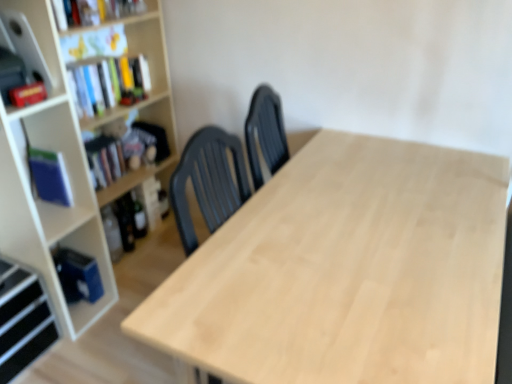
Locate an element on the screen. This screenshot has height=384, width=512. blue matte book at left, which is the third book in top-to-bottom order is located at coordinates (48, 174).

At what (x,y) coordinates should I click in order to perform the action: click on wooden bookshelf at upper left, which is the second shelf from left to right. Please return your answer as a coordinate pair (x, y). Image resolution: width=512 pixels, height=384 pixels. Looking at the image, I should click on (141, 44).

The image size is (512, 384). Describe the element at coordinates (94, 11) in the screenshot. I see `hardcover book at upper left, the first book from the top` at that location.

Describe the element at coordinates (42, 37) in the screenshot. I see `matte white cabinet at upper left` at that location.

I want to click on blue matte book at left, which is the third book in top-to-bottom order, so click(x=48, y=174).

Which point is more forward, (45, 20) or (165, 59)?

The point (45, 20) is more forward.

Is matte white cabinet at upper left positioned beyond the bounds of wooden bookshelf at upper left, the 2th shelf in the bottom-to-top sequence?

Indeed, matte white cabinet at upper left is completely outside wooden bookshelf at upper left, the 2th shelf in the bottom-to-top sequence.

From the picture: Considering the positions of objects matte white cabinet at upper left and wooden bookshelf at upper left, which is the second shelf from left to right, in the image provided, who is behind, matte white cabinet at upper left or wooden bookshelf at upper left, which is the second shelf from left to right,?

wooden bookshelf at upper left, which is the second shelf from left to right, is further from the camera.

Considering the relative positions of matte white cabinet at upper left and black plastic shelf at lower left, placed as the 2th shelf when sorted from top to bottom, in the image provided, is matte white cabinet at upper left to the right of black plastic shelf at lower left, placed as the 2th shelf when sorted from top to bottom, from the viewer's perspective?

Yes.

In terms of size, does matte white cabinet at upper left appear bigger or smaller than black plastic shelf at lower left, which ranks as the second shelf in right-to-left order?

Considering their sizes, matte white cabinet at upper left takes up less space than black plastic shelf at lower left, which ranks as the second shelf in right-to-left order.

Locate an element on the screen. Image resolution: width=512 pixels, height=384 pixels. cabinet located above the black plastic shelf at lower left, which ranks as the second shelf in right-to-left order (from the image's perspective) is located at coordinates pos(42,37).

How many degrees apart are the facing directions of matte white cabinet at upper left and black plastic shelf at lower left, placed as the 2th shelf when sorted from top to bottom?

5.24 degrees separate the facing orientations of matte white cabinet at upper left and black plastic shelf at lower left, placed as the 2th shelf when sorted from top to bottom.

Is point (27, 339) positioned behind point (151, 13)?

No, it is in front of (151, 13).

Which of these two, black plastic shelf at lower left, which is the first shelf from bottom to top, or wooden bookshelf at upper left, the 2th shelf in the bottom-to-top sequence, stands taller?

Standing taller between the two is black plastic shelf at lower left, which is the first shelf from bottom to top.

From a real-world perspective, is black plastic shelf at lower left, placed as the 2th shelf when sorted from top to bottom, above or below wooden bookshelf at upper left, the 2th shelf in the bottom-to-top sequence?

In terms of real-world spatial position, black plastic shelf at lower left, placed as the 2th shelf when sorted from top to bottom, is below wooden bookshelf at upper left, the 2th shelf in the bottom-to-top sequence.

From the picture: Is wooden bookshelf at upper left, the first shelf positioned from the right, surrounded by black plastic shelf at lower left, placed as the 2th shelf when sorted from top to bottom?

No, wooden bookshelf at upper left, the first shelf positioned from the right, is located outside of black plastic shelf at lower left, placed as the 2th shelf when sorted from top to bottom.

In the scene shown: Are matte white cabinet at upper left and light wood table at center located far from each other?

Yes, matte white cabinet at upper left and light wood table at center are quite far apart.

Is matte white cabinet at upper left to the left of light wood table at center from the viewer's perspective?

Indeed, matte white cabinet at upper left is positioned on the left side of light wood table at center.

Does matte white cabinet at upper left have a greater height compared to light wood table at center?

No, matte white cabinet at upper left is not taller than light wood table at center.

Choose the correct answer: Is hardcover book at left, the 2th book from the top, inside black plastic shelf at lower left, which ranks as the second shelf in right-to-left order, or outside it?

hardcover book at left, the 2th book from the top, is outside black plastic shelf at lower left, which ranks as the second shelf in right-to-left order.

Looking at this image, are hardcover book at left, the second book ordered from the bottom, and black plastic shelf at lower left, which is the first shelf in left-to-right order, located far from each other?

No, hardcover book at left, the second book ordered from the bottom, is not far from black plastic shelf at lower left, which is the first shelf in left-to-right order.

From the image's perspective, is hardcover book at left, the second book ordered from the bottom, under black plastic shelf at lower left, which is the first shelf in left-to-right order?

No, from the image's perspective, hardcover book at left, the second book ordered from the bottom, is not below black plastic shelf at lower left, which is the first shelf in left-to-right order.

Is hardcover book at left, the 2th book from the top, facing away from black plastic shelf at lower left, which ranks as the second shelf in right-to-left order?

No, hardcover book at left, the 2th book from the top, is not facing the opposite direction of black plastic shelf at lower left, which ranks as the second shelf in right-to-left order.

Does matte white cabinet at upper left turn towards hardcover book at left, the 2th book from the top?

No, matte white cabinet at upper left is not facing towards hardcover book at left, the 2th book from the top.

Considering the relative sizes of matte white cabinet at upper left and hardcover book at left, the second book ordered from the bottom, in the image provided, is matte white cabinet at upper left shorter than hardcover book at left, the second book ordered from the bottom,?

No.

Considering the positions of objects matte white cabinet at upper left and hardcover book at left, the second book ordered from the bottom, in the image provided, who is behind, matte white cabinet at upper left or hardcover book at left, the second book ordered from the bottom,?

hardcover book at left, the second book ordered from the bottom, is behind.

Considering the relative sizes of hardcover book at upper left, which is counted as the third book, starting from the bottom, and black plastic shelf at lower left, which ranks as the second shelf in right-to-left order, in the image provided, is hardcover book at upper left, which is counted as the third book, starting from the bottom, taller than black plastic shelf at lower left, which ranks as the second shelf in right-to-left order,?

In fact, hardcover book at upper left, which is counted as the third book, starting from the bottom, may be shorter than black plastic shelf at lower left, which ranks as the second shelf in right-to-left order.

Considering the sizes of hardcover book at upper left, which is counted as the third book, starting from the bottom, and black plastic shelf at lower left, which ranks as the second shelf in right-to-left order, in the image, is hardcover book at upper left, which is counted as the third book, starting from the bottom, bigger or smaller than black plastic shelf at lower left, which ranks as the second shelf in right-to-left order,?

Considering their sizes, hardcover book at upper left, which is counted as the third book, starting from the bottom, takes up less space than black plastic shelf at lower left, which ranks as the second shelf in right-to-left order.

In the scene shown: Is hardcover book at upper left, the first book from the top, closer to the viewer compared to black plastic shelf at lower left, which is the first shelf in left-to-right order?

No, hardcover book at upper left, the first book from the top, is further to the viewer.

Find the location of a particular element. This screenshot has height=384, width=512. shelf lying above the matte white cabinet at upper left (from the image's perspective) is located at coordinates (141, 44).

Identify the location of cabinet lying on the right of black plastic shelf at lower left, which is the first shelf from bottom to top. This screenshot has height=384, width=512. (42, 37).

Considering their positions, is hardcover book at upper left, which is counted as the third book, starting from the bottom, positioned further to black plastic shelf at lower left, placed as the 2th shelf when sorted from top to bottom, than matte white cabinet at upper left?

hardcover book at upper left, which is counted as the third book, starting from the bottom.

From the image, which object appears to be nearer to blue matte book at left, arranged as the first book when ordered from the bottom, hardcover book at upper left, which is counted as the third book, starting from the bottom, or wooden bookcase at left?

Based on the image, wooden bookcase at left appears to be nearer to blue matte book at left, arranged as the first book when ordered from the bottom.

When comparing their distances from blue matte book at left, arranged as the first book when ordered from the bottom, does hardcover book at left, the second book ordered from the bottom, or matte white cabinet at upper left seem further?

matte white cabinet at upper left lies further to blue matte book at left, arranged as the first book when ordered from the bottom, than the other object.

From the image, which object appears to be farther from blue matte book at left, which is the third book in top-to-bottom order, wooden bookcase at left or hardcover book at upper left, the first book from the top?

hardcover book at upper left, the first book from the top.

From the picture: When comparing their distances from black plastic shelf at lower left, which is the first shelf in left-to-right order, does light wood table at center or wooden bookcase at left seem further?

The object further to black plastic shelf at lower left, which is the first shelf in left-to-right order, is light wood table at center.

When comparing their distances from wooden bookshelf at upper left, the first shelf positioned from the right, does black plastic shelf at lower left, placed as the 2th shelf when sorted from top to bottom, or hardcover book at upper left, the first book from the top, seem closer?

Based on the image, hardcover book at upper left, the first book from the top, appears to be nearer to wooden bookshelf at upper left, the first shelf positioned from the right.

Which object lies nearer to the anchor point black plastic shelf at lower left, which is the first shelf in left-to-right order, hardcover book at upper left, which is counted as the third book, starting from the bottom, or wooden bookcase at left?

wooden bookcase at left is positioned closer to the anchor black plastic shelf at lower left, which is the first shelf in left-to-right order.

From the image, which object appears to be nearer to wooden bookshelf at upper left, the first shelf from the top, black plastic shelf at lower left, which ranks as the second shelf in right-to-left order, or wooden bookcase at left?

wooden bookcase at left lies closer to wooden bookshelf at upper left, the first shelf from the top, than the other object.

Locate an element on the screen. cabinet situated between blue matte book at left, which is the third book in top-to-bottom order, and light wood table at center from left to right is located at coordinates (42, 37).

The width and height of the screenshot is (512, 384). In order to click on bookcase between matte white cabinet at upper left and blue matte book at left, arranged as the first book when ordered from the bottom, in the vertical direction in this screenshot , I will do pyautogui.click(x=76, y=162).

Identify the location of book that lies between wooden bookshelf at upper left, which is the second shelf from left to right, and blue matte book at left, arranged as the first book when ordered from the bottom, from top to bottom. This screenshot has height=384, width=512. (105, 160).

The width and height of the screenshot is (512, 384). I want to click on shelf between hardcover book at upper left, which is counted as the third book, starting from the bottom, and black plastic shelf at lower left, which ranks as the second shelf in right-to-left order, from top to bottom, so click(x=141, y=44).